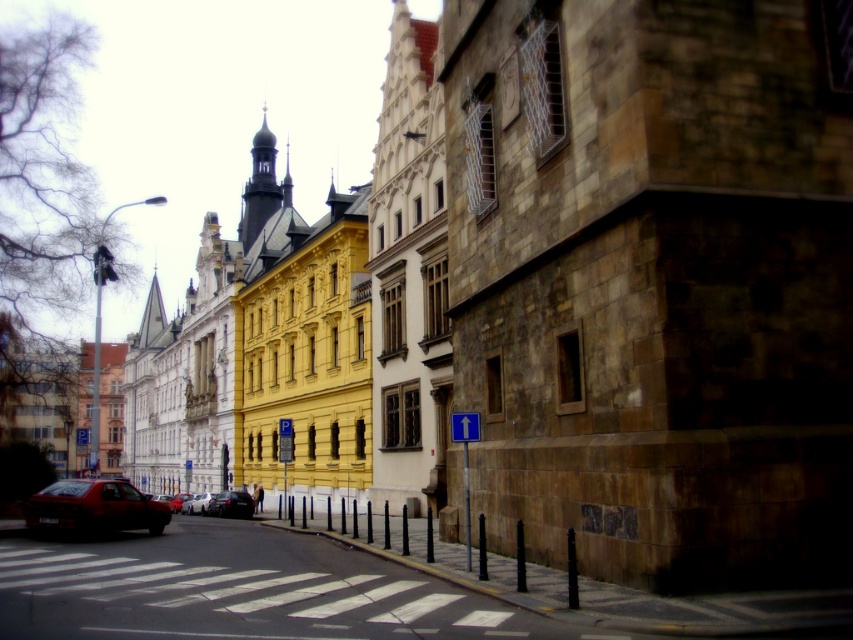
You are a delivery driver needing to park your 2.5 meter wide truck next to the metallic silver car at center and the shiny red car at center. Can both cars fit alongside your truck in the available space if the total space is 8 meters wide?

The metallic silver car at center has a lesser width compared to shiny red car at center. If we assume the shiny red car is approximately 2 meters wide, the metallic silver car might be around 1.5 meters. Adding the truck at 2.5 meters, the total width would be 2.5m truck plus 2m red car plus 1.5m silver car equals 6 meters. Since the total space is 8 meters, there would be 2 meters remaining. Therefore, yes, both cars and the truck can fit within the 8 meter space.

From the picture: You are driving a metallic silver car at center and want to see the blue plastic sign at upper center. Can you see it without moving the car?

The blue plastic sign at upper center is in front of the metallic silver car at center, so yes, you can see it without moving the car.